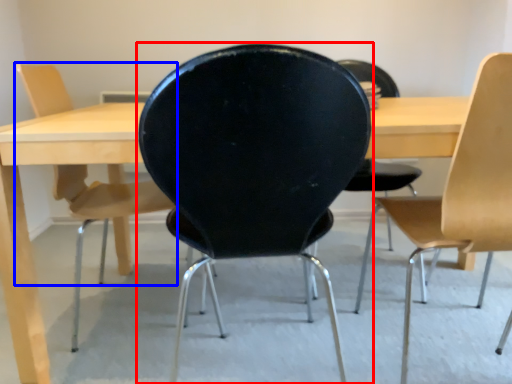
Question: Which of the following is the closest to the observer, chair (highlighted by a red box) or chair (highlighted by a blue box)?

Choices:
 (A) chair
 (B) chair

Answer: (A)